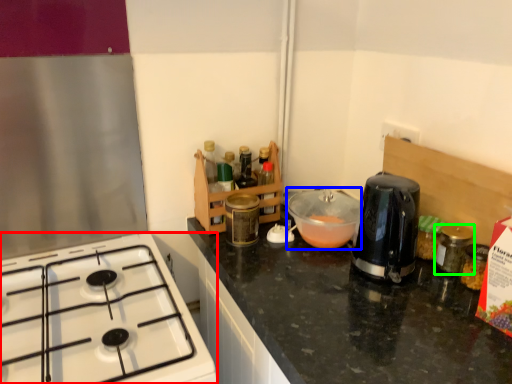
Question: Based on their relative distances, which object is nearer to gas stove (highlighted by a red box)? Choose from bowl (highlighted by a blue box) and bottle (highlighted by a green box).

Choices:
 (A) bowl
 (B) bottle

Answer: (A)